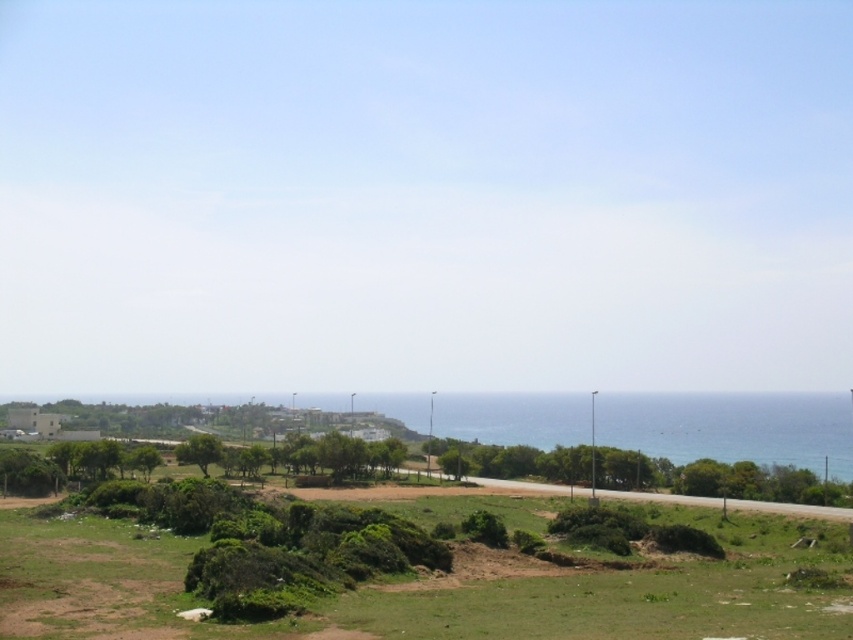
Who is higher up, green leafy tree at lower center or green leafy tree at lower left?

Positioned higher is green leafy tree at lower left.

Does point (546, 474) lie behind point (202, 458)?

Yes.

Who is more distant from viewer, [630,465] or [207,440]?

Positioned behind is point [630,465].

Locate an element on the screen. The width and height of the screenshot is (853, 640). green leafy tree at lower center is located at coordinates (641, 472).